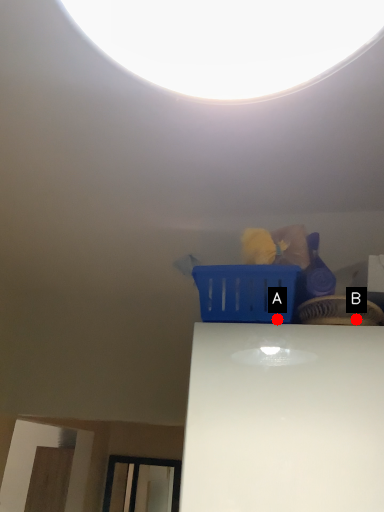
Question: Two points are circled on the image, labeled by A and B beside each circle. Which point is further to the camera?

Choices:
 (A) A is further
 (B) B is further

Answer: (A)